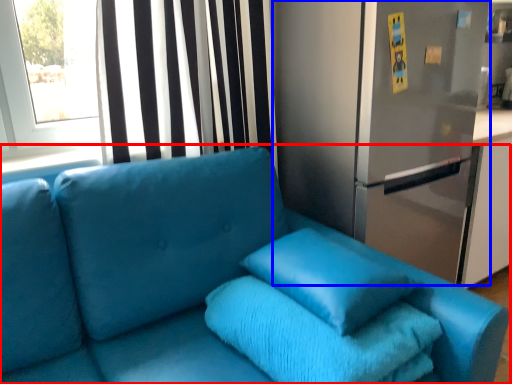
Question: Which point is further to the camera, studio couch (highlighted by a red box) or fridge (highlighted by a blue box)?

Choices:
 (A) studio couch
 (B) fridge

Answer: (B)